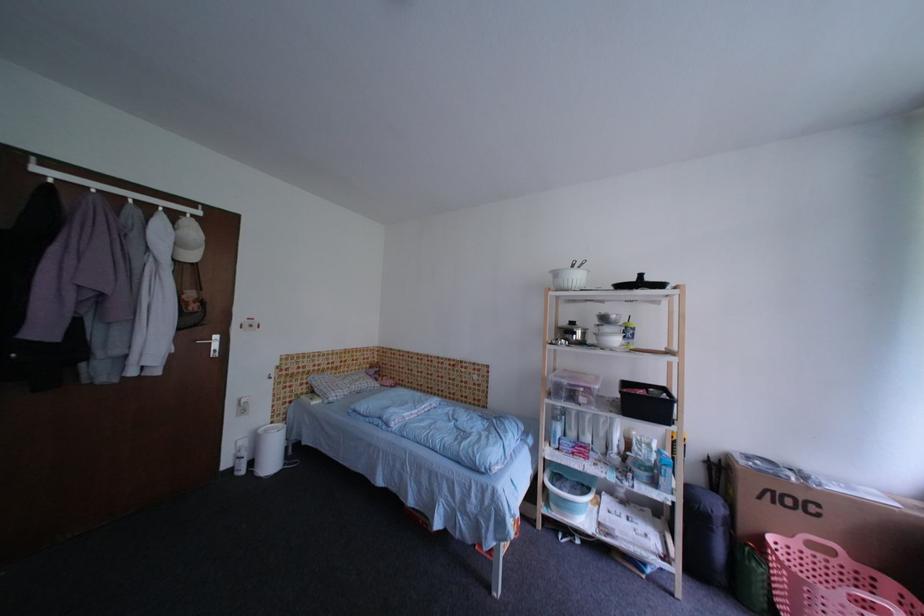
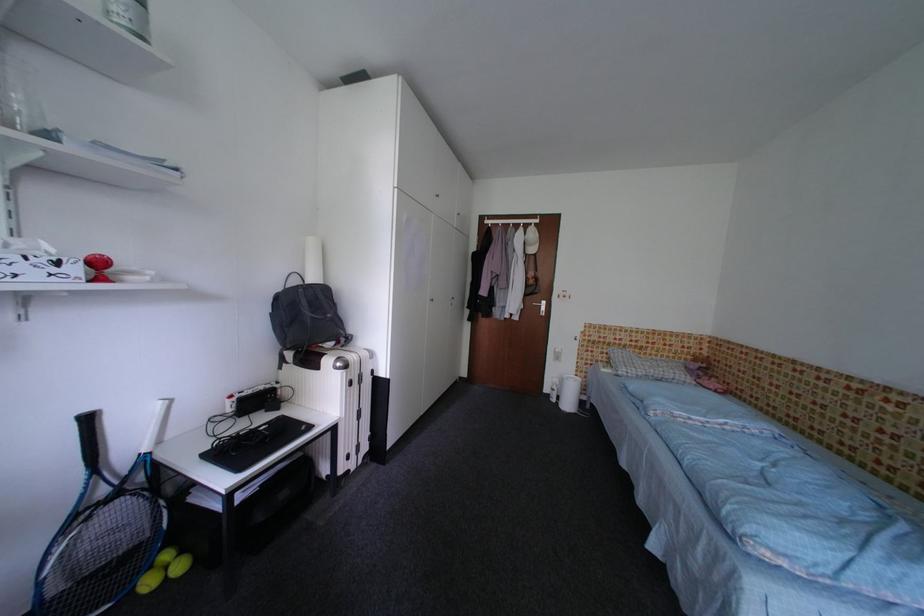
In the second image, find the point that corresponds to the point at 171,220 in the first image.

(529, 232)